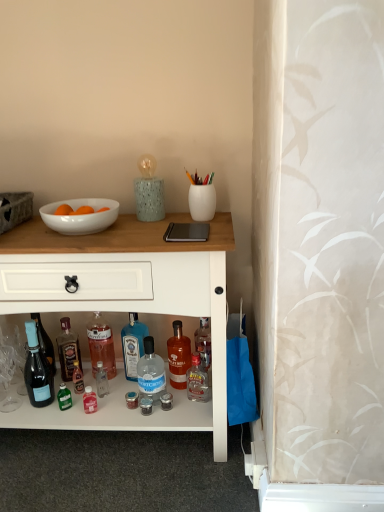
The image size is (384, 512). Describe the element at coordinates (37, 370) in the screenshot. I see `matte black champagne bottle at lower left` at that location.

Find the location of a particular element. The width and height of the screenshot is (384, 512). clear glass bottle at center, which is counted as the 2th bottle, starting from the right is located at coordinates (151, 372).

You are a GUI agent. You are given a task and a screenshot of the screen. Output one action in this format:
    pyautogui.click(x=<x>, y=<y>)
    Task: Click on the matte black champagne bottle at lower left
    This screenshot has height=512, width=384.
    Given the screenshot: What is the action you would take?
    pyautogui.click(x=37, y=370)

Does matte black champagne bottle at lower left appear on the left side of clear glass bottle at center, which is counted as the 2th bottle, starting from the right?

Yes, matte black champagne bottle at lower left is to the left of clear glass bottle at center, which is counted as the 2th bottle, starting from the right.

Can you tell me how much matte black champagne bottle at lower left and clear glass bottle at center, which is counted as the 2th bottle, starting from the right, differ in facing direction?

There is a 8.83-degree angle between the facing directions of matte black champagne bottle at lower left and clear glass bottle at center, which is counted as the 2th bottle, starting from the right.

Between matte black champagne bottle at lower left and clear glass bottle at center, placed as the 4th bottle when sorted from left to right, which one has larger width?

With larger width is clear glass bottle at center, placed as the 4th bottle when sorted from left to right.

Based on the photo, how distant is matte black champagne bottle at lower left from clear glass bottle at center, which is counted as the 2th bottle, starting from the right?

matte black champagne bottle at lower left is 34.05 centimeters from clear glass bottle at center, which is counted as the 2th bottle, starting from the right.

How many degrees apart are the facing directions of white glossy cabinet at center and translucent amber glass bottle at center, which ranks as the fifth bottle in left-to-right order?

white glossy cabinet at center and translucent amber glass bottle at center, which ranks as the fifth bottle in left-to-right order, are facing 0.326 degrees away from each other.

Is white glossy cabinet at center wider than translucent amber glass bottle at center, which ranks as the fifth bottle in left-to-right order?

Correct, the width of white glossy cabinet at center exceeds that of translucent amber glass bottle at center, which ranks as the fifth bottle in left-to-right order.

Considering the relative positions of white glossy cabinet at center and translucent amber glass bottle at center, which ranks as the fifth bottle in left-to-right order, in the image provided, is white glossy cabinet at center to the right of translucent amber glass bottle at center, which ranks as the fifth bottle in left-to-right order, from the viewer's perspective?

No.

Does white glossy cabinet at center turn towards translucent amber glass bottle at center, which ranks as the fifth bottle in left-to-right order?

Yes, white glossy cabinet at center is facing translucent amber glass bottle at center, which ranks as the fifth bottle in left-to-right order.

Is white glossy bowl at upper left facing away from blue glass bottle at center, the 3th bottle viewed from the right?

No, white glossy bowl at upper left's orientation is not away from blue glass bottle at center, the 3th bottle viewed from the right.

From a real-world perspective, relative to blue glass bottle at center, the 3th bottle viewed from the right, is white glossy bowl at upper left vertically above or below?

From a real-world perspective, white glossy bowl at upper left is physically above blue glass bottle at center, the 3th bottle viewed from the right.

From the image's perspective, is white glossy bowl at upper left above blue glass bottle at center, the 3th bottle viewed from the right?

Correct, white glossy bowl at upper left appears higher than blue glass bottle at center, the 3th bottle viewed from the right, in the image.

Can we say white glossy bowl at upper left lies outside blue glass bottle at center, which is counted as the 3th bottle, starting from the left?

Absolutely, white glossy bowl at upper left is external to blue glass bottle at center, which is counted as the 3th bottle, starting from the left.

Identify the location of the 1st bottle above the translucent amber glass bottle at center, which ranks as the fifth bottle in left-to-right order (from a real-world perspective). (133, 345).

Is translucent amber glass bottle at center, which is the first bottle in right-to-left order, in contact with blue glass bottle at center, the 3th bottle viewed from the right?

No.

Is blue glass bottle at center, the 3th bottle viewed from the right, at the back of translucent amber glass bottle at center, which ranks as the fifth bottle in left-to-right order?

No, translucent amber glass bottle at center, which ranks as the fifth bottle in left-to-right order,'s orientation is not away from blue glass bottle at center, the 3th bottle viewed from the right.

Is translucent amber glass bottle at center, which is the first bottle in right-to-left order, not inside blue glass bottle at center, which is counted as the 3th bottle, starting from the left?

translucent amber glass bottle at center, which is the first bottle in right-to-left order, is positioned outside blue glass bottle at center, which is counted as the 3th bottle, starting from the left.

Does white glossy cabinet at center come behind clear glass bottle at center, which is counted as the 2th bottle, starting from the right?

No, it is in front of clear glass bottle at center, which is counted as the 2th bottle, starting from the right.

Based on their positions, is white glossy cabinet at center located to the left or right of clear glass bottle at center, which is counted as the 2th bottle, starting from the right?

white glossy cabinet at center is to the left of clear glass bottle at center, which is counted as the 2th bottle, starting from the right.

From the image's perspective, which one is positioned lower, white glossy cabinet at center or clear glass bottle at center, which is counted as the 2th bottle, starting from the right?

clear glass bottle at center, which is counted as the 2th bottle, starting from the right.

Which is more to the right, clear glass bottle at center, placed as the 4th bottle when sorted from left to right, or shiny dark brown bottle at lower left, the fifth bottle from the right?

From the viewer's perspective, clear glass bottle at center, placed as the 4th bottle when sorted from left to right, appears more on the right side.

Based on the photo, from the image's perspective, which object appears higher, clear glass bottle at center, which is counted as the 2th bottle, starting from the right, or shiny dark brown bottle at lower left, positioned as the 1th bottle in left-to-right order?

shiny dark brown bottle at lower left, positioned as the 1th bottle in left-to-right order, from the image's perspective.

Is the depth of clear glass bottle at center, placed as the 4th bottle when sorted from left to right, less than that of shiny dark brown bottle at lower left, the fifth bottle from the right?

Yes, clear glass bottle at center, placed as the 4th bottle when sorted from left to right, is closer to the camera.

Is shiny dark brown bottle at lower left, the fifth bottle from the right, shorter than clear glass bottle at center, placed as the 4th bottle when sorted from left to right?

Incorrect, the height of shiny dark brown bottle at lower left, the fifth bottle from the right, does not fall short of that of clear glass bottle at center, placed as the 4th bottle when sorted from left to right.

Where is `the 3rd bottle to the right of the shiny dark brown bottle at lower left, the fifth bottle from the right, counting from the anchor's position`? The height and width of the screenshot is (512, 384). the 3rd bottle to the right of the shiny dark brown bottle at lower left, the fifth bottle from the right, counting from the anchor's position is located at coordinates (151, 372).

Is shiny dark brown bottle at lower left, positioned as the 1th bottle in left-to-right order, oriented towards clear glass bottle at center, placed as the 4th bottle when sorted from left to right?

No, shiny dark brown bottle at lower left, positioned as the 1th bottle in left-to-right order, is not facing towards clear glass bottle at center, placed as the 4th bottle when sorted from left to right.

The height and width of the screenshot is (512, 384). Identify the location of beer bottle lying above the clear glass bottle at center, placed as the 4th bottle when sorted from left to right (from the image's perspective). (37, 370).

This screenshot has height=512, width=384. What are the coordinates of `the 3rd bottle below when counting from the white glossy cabinet at center (from the image's perspective)` in the screenshot? It's located at (178, 356).

Based on their spatial positions, is clear glass bottle at center, which ranks as the 2th bottle in left-to-right order, or white glossy bowl at upper left further from matte black champagne bottle at lower left?

white glossy bowl at upper left lies further to matte black champagne bottle at lower left than the other object.

Based on their spatial positions, is translucent amber glass bottle at center, which ranks as the fifth bottle in left-to-right order, or white glossy bowl at upper left further from clear glass bottle at center, which ranks as the 2th bottle in left-to-right order?

Based on the image, white glossy bowl at upper left appears to be further to clear glass bottle at center, which ranks as the 2th bottle in left-to-right order.

Which object lies nearer to the anchor point white glossy cabinet at center, white glossy bowl at upper left or clear glass bottle at center, which ranks as the 2th bottle in left-to-right order?

Based on the image, white glossy bowl at upper left appears to be nearer to white glossy cabinet at center.

Considering their positions, is matte black champagne bottle at lower left positioned further to white glossy cabinet at center than clear glass bottle at center, placed as the 4th bottle when sorted from left to right?

matte black champagne bottle at lower left is positioned further to the anchor white glossy cabinet at center.

Looking at the image, which one is located further to shiny dark brown bottle at lower left, positioned as the 1th bottle in left-to-right order, clear glass bottle at center, which is counted as the 2th bottle, starting from the right, or matte black champagne bottle at lower left?

clear glass bottle at center, which is counted as the 2th bottle, starting from the right, is positioned further to the anchor shiny dark brown bottle at lower left, positioned as the 1th bottle in left-to-right order.

Considering their positions, is translucent amber glass bottle at center, which ranks as the fifth bottle in left-to-right order, positioned further to matte black champagne bottle at lower left than clear glass bottle at center, placed as the 4th bottle when sorted from left to right?

translucent amber glass bottle at center, which ranks as the fifth bottle in left-to-right order, is further to matte black champagne bottle at lower left.

Looking at this image, when comparing their distances from clear glass bottle at center, which is counted as the 2th bottle, starting from the right, does clear glass bottle at center, which is the fourth bottle from right to left, or matte black champagne bottle at lower left seem closer?

clear glass bottle at center, which is the fourth bottle from right to left, is positioned closer to the anchor clear glass bottle at center, which is counted as the 2th bottle, starting from the right.

Based on their spatial positions, is clear glass bottle at center, which is counted as the 2th bottle, starting from the right, or matte black champagne bottle at lower left further from blue glass bottle at center, which is counted as the 3th bottle, starting from the left?

Among the two, matte black champagne bottle at lower left is located further to blue glass bottle at center, which is counted as the 3th bottle, starting from the left.

Identify the location of beer bottle between white glossy cabinet at center and shiny dark brown bottle at lower left, positioned as the 1th bottle in left-to-right order, along the z-axis. (37, 370).

Find the location of a particular element. The height and width of the screenshot is (512, 384). beer bottle between white glossy bowl at upper left and translucent amber glass bottle at center, which ranks as the fifth bottle in left-to-right order, from top to bottom is located at coordinates (37, 370).

This screenshot has width=384, height=512. What are the coordinates of `beer bottle between white glossy bowl at upper left and clear glass bottle at center, which is counted as the 2th bottle, starting from the right, vertically` in the screenshot? It's located at (37, 370).

Find the location of a particular element. bottle between blue glass bottle at center, the 3th bottle viewed from the right, and translucent amber glass bottle at center, which ranks as the fifth bottle in left-to-right order, from left to right is located at coordinates [151, 372].